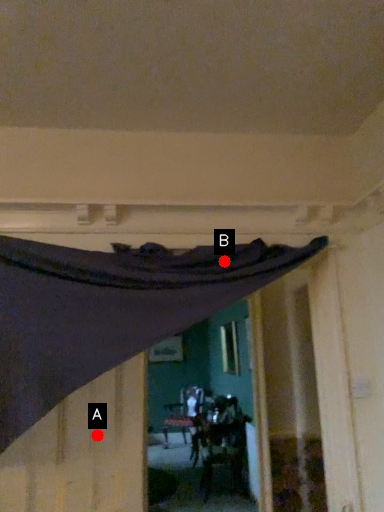
Question: Two points are circled on the image, labeled by A and B beside each circle. Among these points, which one is farthest from the camera?

Choices:
 (A) A is further
 (B) B is further

Answer: (B)